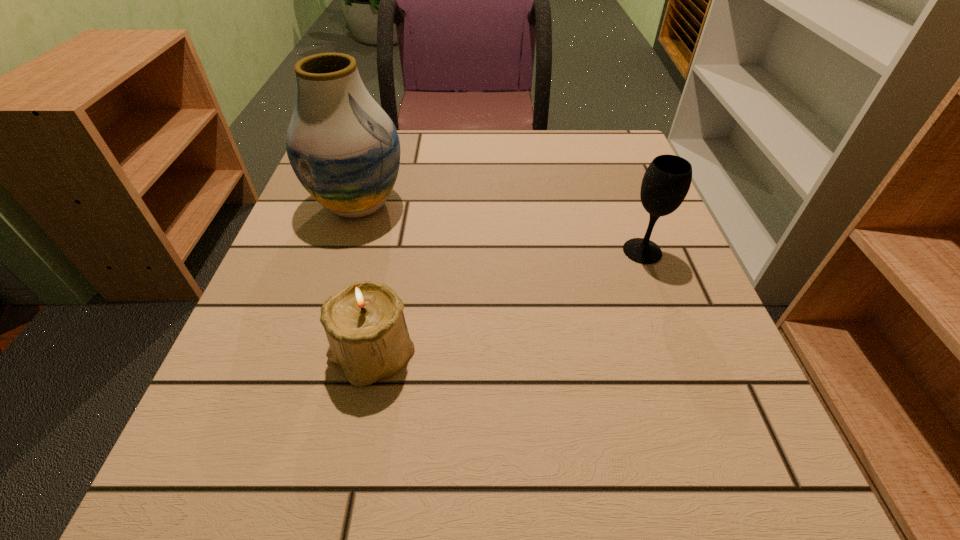
Locate an element on the screen. The width and height of the screenshot is (960, 540). the farthest object is located at coordinates (344, 149).

At what (x,y) coordinates should I click in order to perform the action: click on vase. Please return your answer as a coordinate pair (x, y). This screenshot has width=960, height=540. Looking at the image, I should click on (344, 149).

This screenshot has width=960, height=540. Identify the location of the rightmost object. (666, 182).

This screenshot has width=960, height=540. I want to click on wineglass, so click(x=666, y=182).

Where is `candle_holder`? The image size is (960, 540). candle_holder is located at coordinates [364, 322].

The image size is (960, 540). Identify the location of the shortest object. (364, 322).

Where is `free space located on the back of the farthest object`? This screenshot has width=960, height=540. free space located on the back of the farthest object is located at coordinates (375, 151).

Identify the location of free space located 0.250m on the back of the wineglass. Image resolution: width=960 pixels, height=540 pixels. (611, 167).

Locate an element on the screen. blank space located 0.370m on the right of the candle_holder is located at coordinates (660, 354).

The image size is (960, 540). Identify the location of object at the far edge. (344, 149).